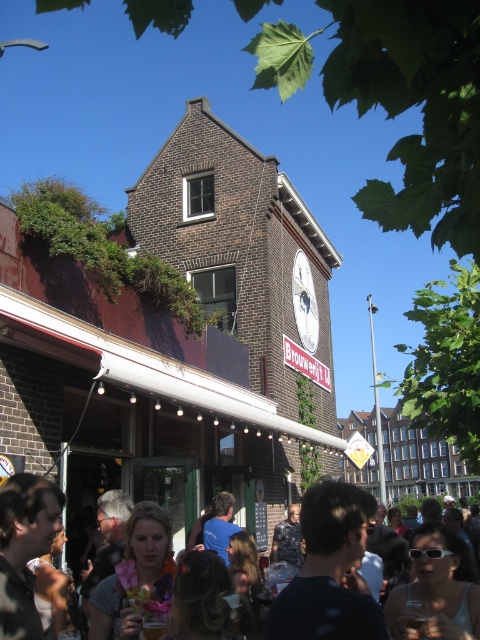
Question: Among these points, which one is nearest to the camera?

Choices:
 (A) (374, 305)
 (B) (343, 516)

Answer: (B)

Question: Which point appears farthest from the camera in this image?

Choices:
 (A) (368, 304)
 (B) (356, 529)

Answer: (A)

Question: Can you confirm if matte black hair at center is bigger than metallic pole at center?

Choices:
 (A) yes
 (B) no

Answer: (B)

Question: Is matte black hair at center positioned in front of metallic pole at center?

Choices:
 (A) no
 (B) yes

Answer: (B)

Question: Is matte black hair at center bigger than metallic pole at center?

Choices:
 (A) yes
 (B) no

Answer: (B)